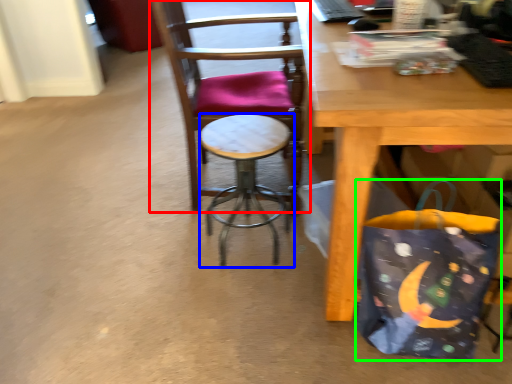
Question: Which object is positioned closest to chair (highlighted by a red box)? Select from stool (highlighted by a blue box) and grocery bag (highlighted by a green box).

Choices:
 (A) stool
 (B) grocery bag

Answer: (A)